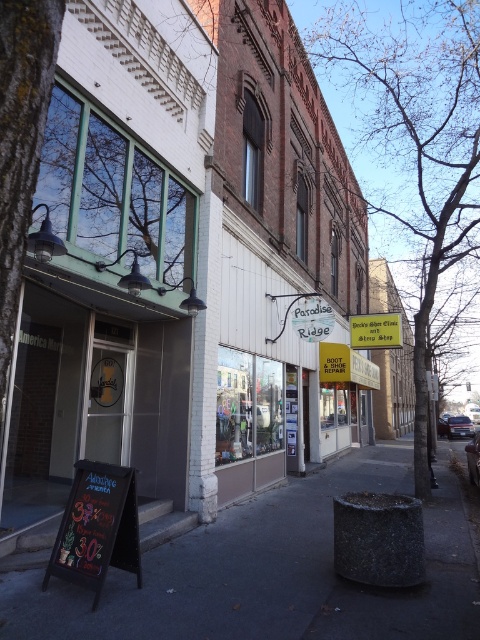
Question: Is dark asphalt pavement at center wider than chalkboard sign at lower left?

Choices:
 (A) no
 (B) yes

Answer: (B)

Question: Is dark asphalt pavement at center positioned behind chalkboard sign at lower left?

Choices:
 (A) yes
 (B) no

Answer: (B)

Question: Which point is closer to the camera?

Choices:
 (A) (96, 536)
 (B) (136, 592)

Answer: (A)

Question: Among these points, which one is farthest from the camera?

Choices:
 (A) pyautogui.click(x=134, y=490)
 (B) pyautogui.click(x=448, y=552)

Answer: (B)

Question: Among these objects, which one is farthest from the camera?

Choices:
 (A) dark asphalt pavement at center
 (B) chalkboard sign at lower left

Answer: (B)

Question: Is dark asphalt pavement at center to the left of chalkboard sign at lower left from the viewer's perspective?

Choices:
 (A) no
 (B) yes

Answer: (A)